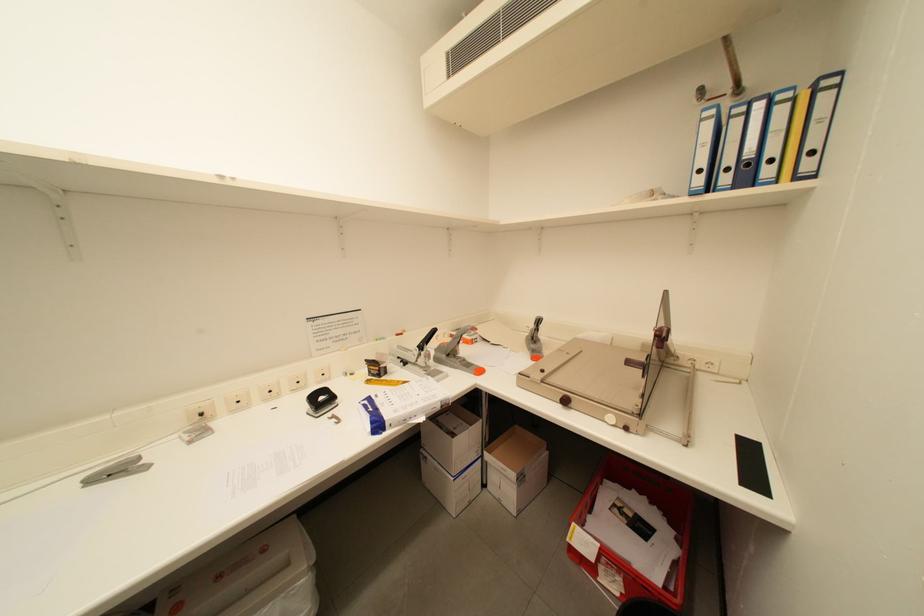
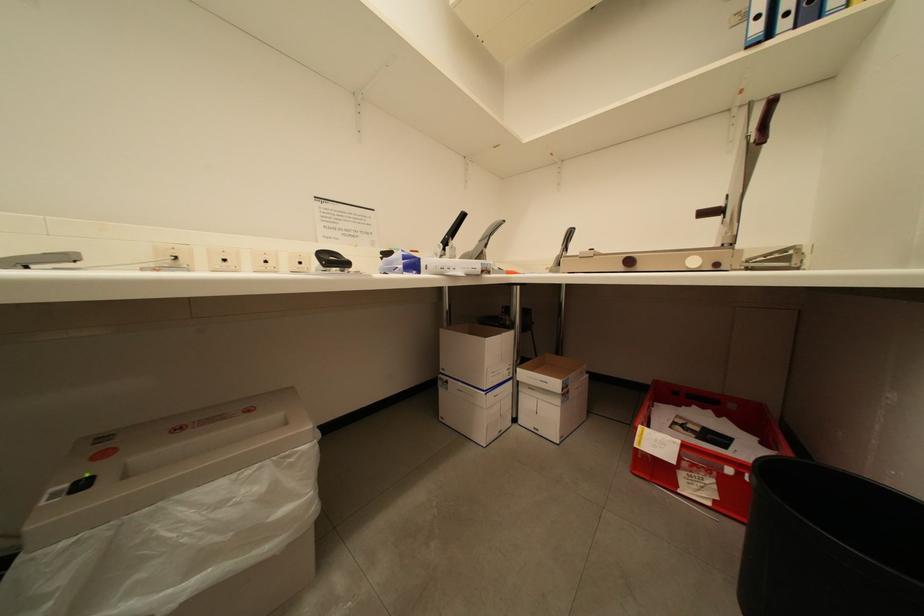
Question: The images are taken continuously from a first-person perspective. In which direction is your viewpoint rotating?

Choices:
 (A) Left
 (B) Right
 (C) Up
 (D) Down

Answer: (C)